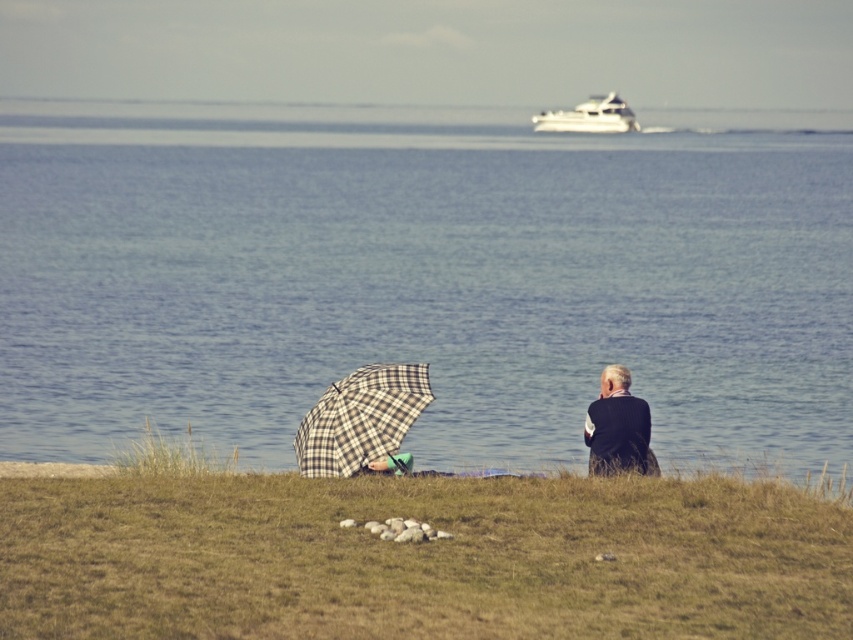
Question: Considering the relative positions of blue water at center and dark blue wool sweater at right in the image provided, where is blue water at center located with respect to dark blue wool sweater at right?

Choices:
 (A) above
 (B) below

Answer: (A)

Question: Is green grass at lower center below dark blue wool sweater at right?

Choices:
 (A) no
 (B) yes

Answer: (B)

Question: Among these points, which one is nearest to the camera?

Choices:
 (A) (410, 227)
 (B) (303, 417)

Answer: (B)

Question: Which point appears farthest from the camera in this image?

Choices:
 (A) (543, 432)
 (B) (358, 403)
 (C) (589, 109)
 (D) (231, 595)

Answer: (C)

Question: Is plaid fabric umbrella at lower left below white glossy yacht at upper center?

Choices:
 (A) no
 (B) yes

Answer: (B)

Question: Based on their relative distances, which object is nearer to the white glossy yacht at upper center?

Choices:
 (A) green grass at lower center
 (B) blue water at center
 (C) plaid fabric umbrella at lower left
 (D) dark blue wool sweater at right

Answer: (B)